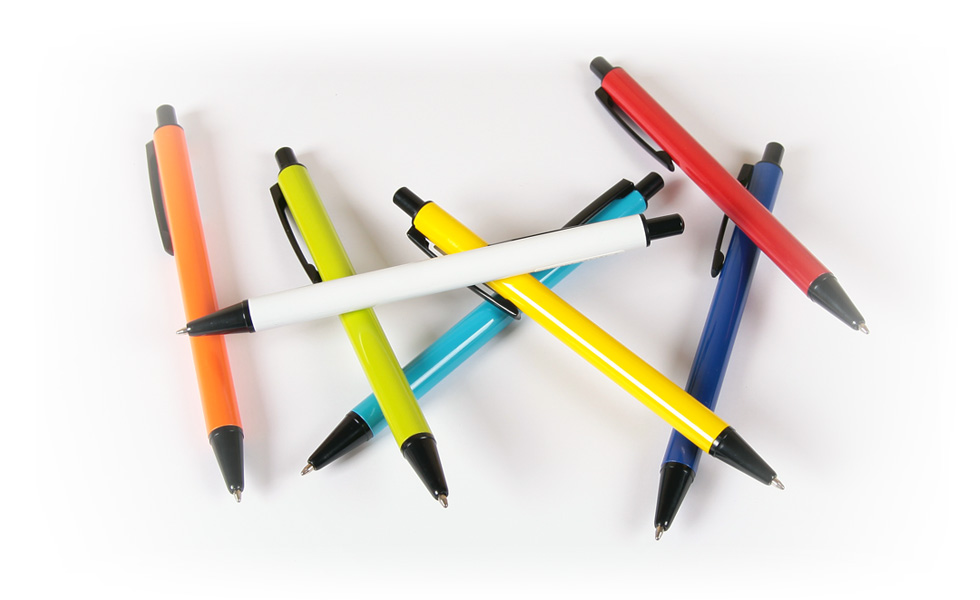
This screenshot has height=600, width=980. In order to click on pens in this screenshot , I will do `click(201, 278)`, `click(324, 252)`, `click(402, 291)`, `click(465, 346)`, `click(564, 324)`, `click(728, 320)`, `click(770, 235)`.